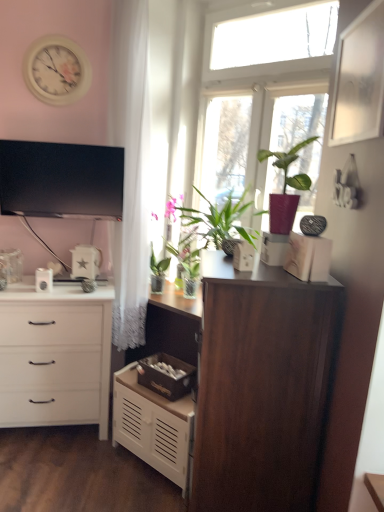
Locate an element on the screen. vacant region to the right of white glossy kettle at left, the third appliance when ordered from right to left is located at coordinates (65, 285).